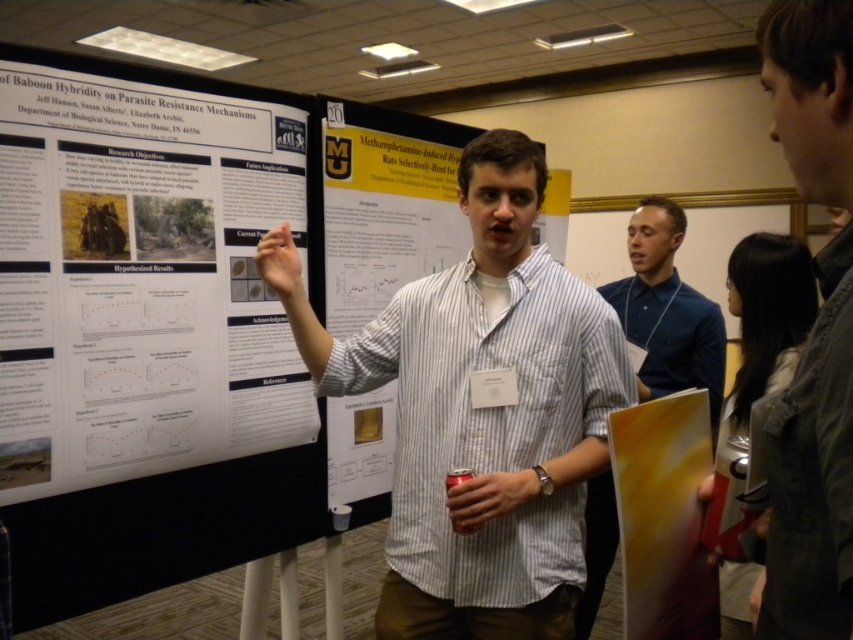
You are attending a conference and want to approach the presenter to ask a question. Based on their clothing, which item is shorter in height between the gray denim jacket at upper right and the white striped shirt at center?

The gray denim jacket at upper right has a lesser height compared to the white striped shirt at center, so the gray denim jacket at upper right is shorter in height.

You are attending a conference and need to decide which clothing item to approach for a conversation. The gray denim jacket at upper right and the blue fabric shirt at center are both visible. Which clothing item is narrower in width and thus might be easier to approach without blocking others?

The gray denim jacket at upper right has a lesser width compared to the blue fabric shirt at center, so it might be easier to approach the gray denim jacket at upper right without blocking others.